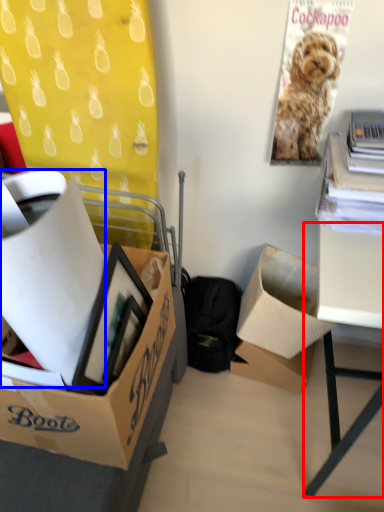
Question: Which of the following is the farthest to the observer, desk (highlighted by a red box) or box (highlighted by a blue box)?

Choices:
 (A) desk
 (B) box

Answer: (A)